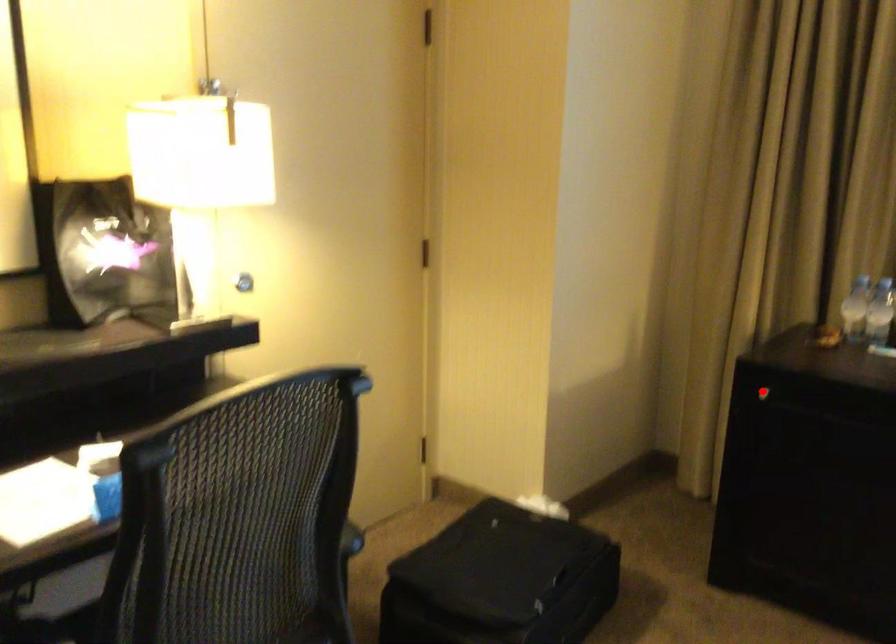
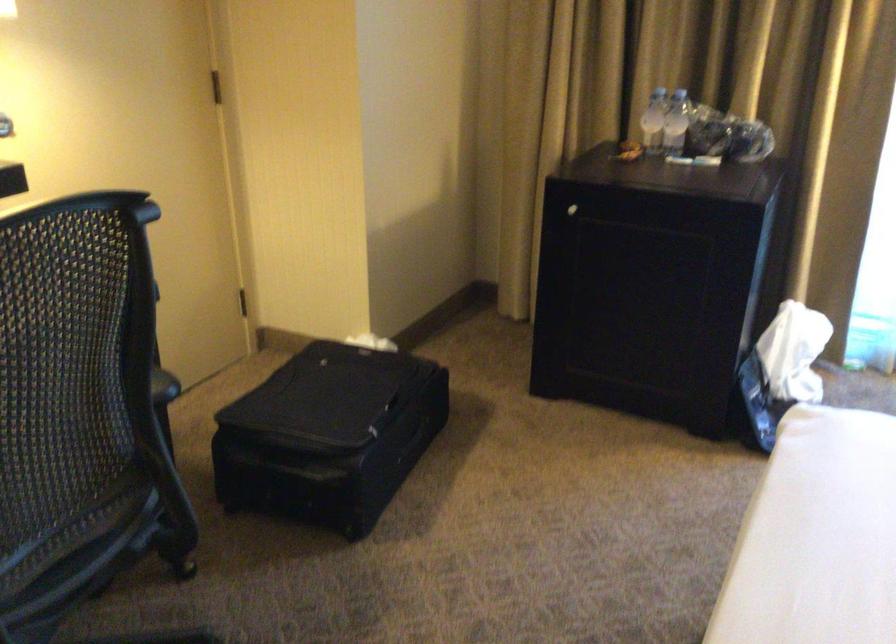
Where in the second image is the point corresponding to the highlighted location from the first image?

(572, 210)